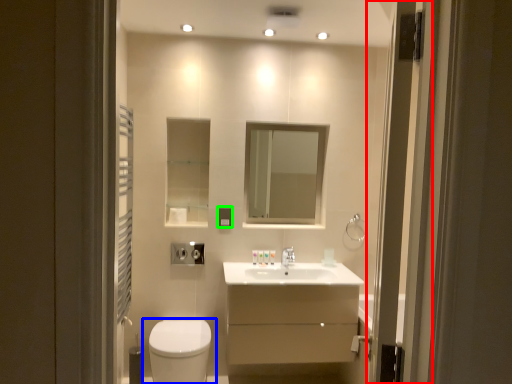
Question: Based on their relative distances, which object is farther from screen door (highlighted by a red box)? Choose from toilet (highlighted by a blue box) and light switch (highlighted by a green box).

Choices:
 (A) toilet
 (B) light switch

Answer: (B)